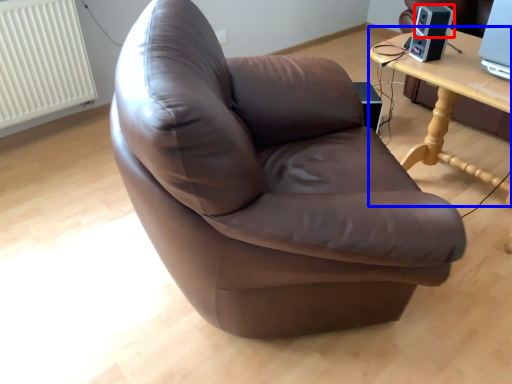
Question: Which of the following is the farthest to the observer, speaker (highlighted by a red box) or table (highlighted by a blue box)?

Choices:
 (A) speaker
 (B) table

Answer: (A)